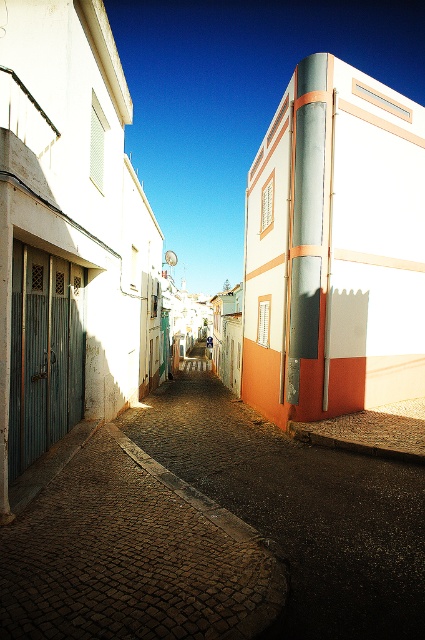
Question: Is cobblestone alley at center smaller than metallic silver pipe at center?

Choices:
 (A) no
 (B) yes

Answer: (B)

Question: Observing the image, what is the correct spatial positioning of cobblestone alley at center in reference to cobblestone street at center?

Choices:
 (A) below
 (B) above

Answer: (A)

Question: Which of the following is the closest to the observer?

Choices:
 (A) metallic silver pipe at center
 (B) cobblestone street at center
 (C) cobblestone alley at center

Answer: (B)

Question: Which of the following is the farthest from the observer?

Choices:
 (A) (370, 128)
 (B) (183, 618)

Answer: (A)

Question: Where is cobblestone alley at center located in relation to metallic silver pipe at center in the image?

Choices:
 (A) above
 (B) below

Answer: (B)

Question: Among these points, which one is farthest from the camera?

Choices:
 (A) (379, 630)
 (B) (189, 506)
 (C) (312, 161)

Answer: (C)